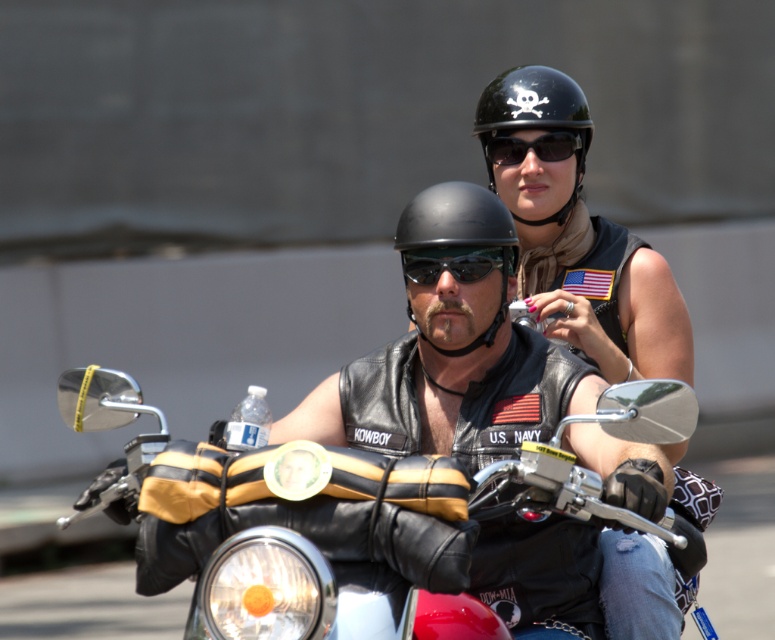
Question: Which object is closer to the camera taking this photo?

Choices:
 (A) black leather motorcycle at center
 (B) black matte sunglasses at center
 (C) black matte sunglasses at upper center

Answer: (A)

Question: Among these points, which one is farthest from the camera?

Choices:
 (A) (563, 102)
 (B) (639, 406)

Answer: (A)

Question: Is leather vest at center bigger than black leather motorcycle at center?

Choices:
 (A) yes
 (B) no

Answer: (A)

Question: Which point is closer to the camera taking this photo?

Choices:
 (A) (481, 227)
 (B) (500, 310)
 (C) (574, 493)
 (D) (429, 260)

Answer: (C)

Question: Can you confirm if black leather motorcycle at center is positioned below black matte helmet at center?

Choices:
 (A) yes
 (B) no

Answer: (A)

Question: Can you confirm if leather vest at center is positioned to the right of black matte sunglasses at upper center?

Choices:
 (A) yes
 (B) no

Answer: (B)